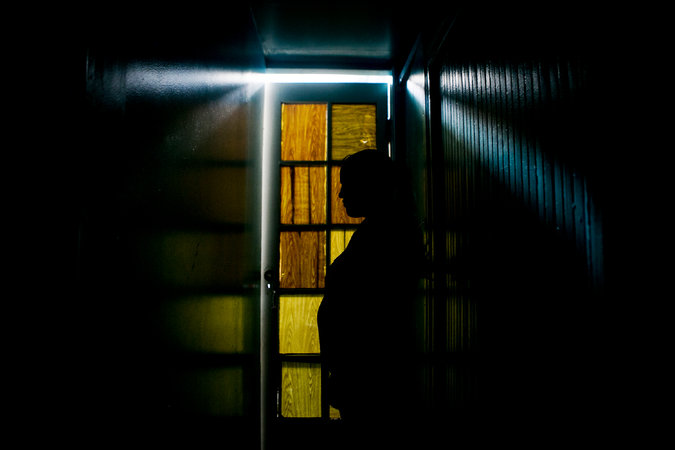
Find the location of a particular element. door is located at coordinates (296, 257).